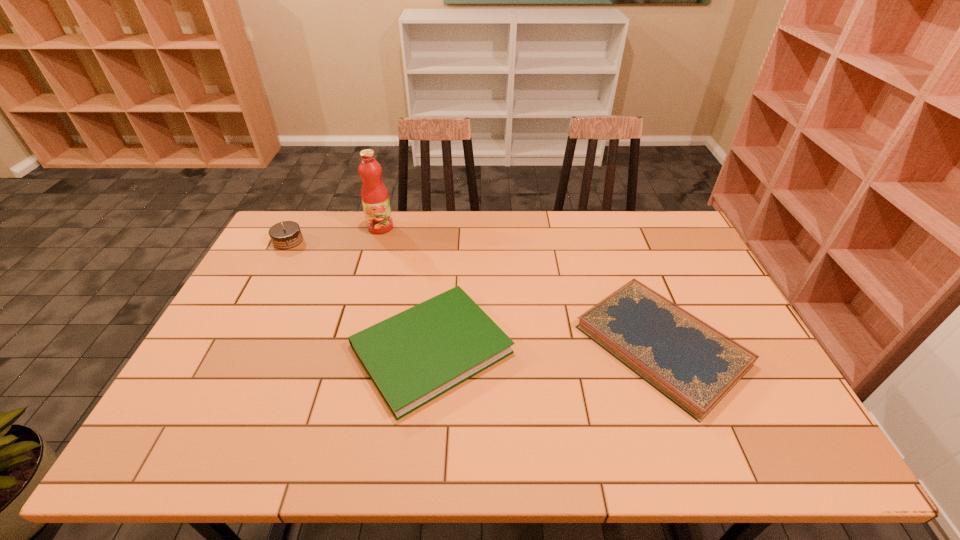
The width and height of the screenshot is (960, 540). What are the coordinates of `the tallest object` in the screenshot? It's located at (375, 199).

Identify the location of the second tallest object. The height and width of the screenshot is (540, 960). (285, 235).

The height and width of the screenshot is (540, 960). Find the location of `chocolate cake`. chocolate cake is located at coordinates (285, 235).

You are a GUI agent. You are given a task and a screenshot of the screen. Output one action in this format:
    pyautogui.click(x=<x>, y=<y>)
    Task: Click on the left paperback book
    This screenshot has height=540, width=960.
    Given the screenshot: What is the action you would take?
    pyautogui.click(x=413, y=357)

The image size is (960, 540). I want to click on the rightmost object, so point(694,365).

Where is `vacant region located on the front label of the tallest object`? Image resolution: width=960 pixels, height=540 pixels. vacant region located on the front label of the tallest object is located at coordinates (357, 308).

Locate an element on the screen. The height and width of the screenshot is (540, 960). free location located 0.090m on the back of the chocolate cake is located at coordinates (300, 218).

The height and width of the screenshot is (540, 960). I want to click on vacant space located on the left of the left paperback book, so click(x=249, y=349).

Find the location of a particular element. The image size is (960, 540). free space located 0.250m on the back of the rightmost object is located at coordinates (619, 238).

Identify the location of fruit juice at the far edge. (375, 199).